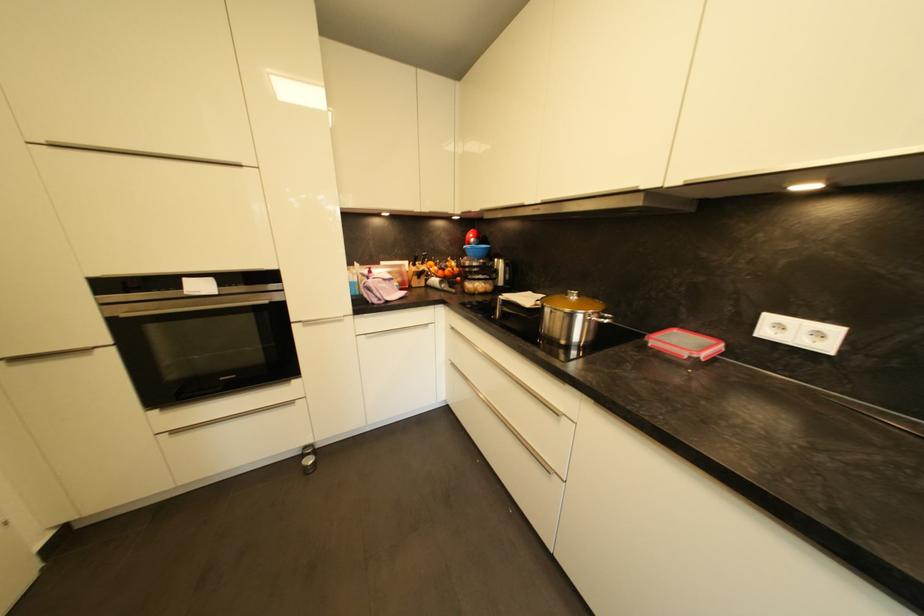
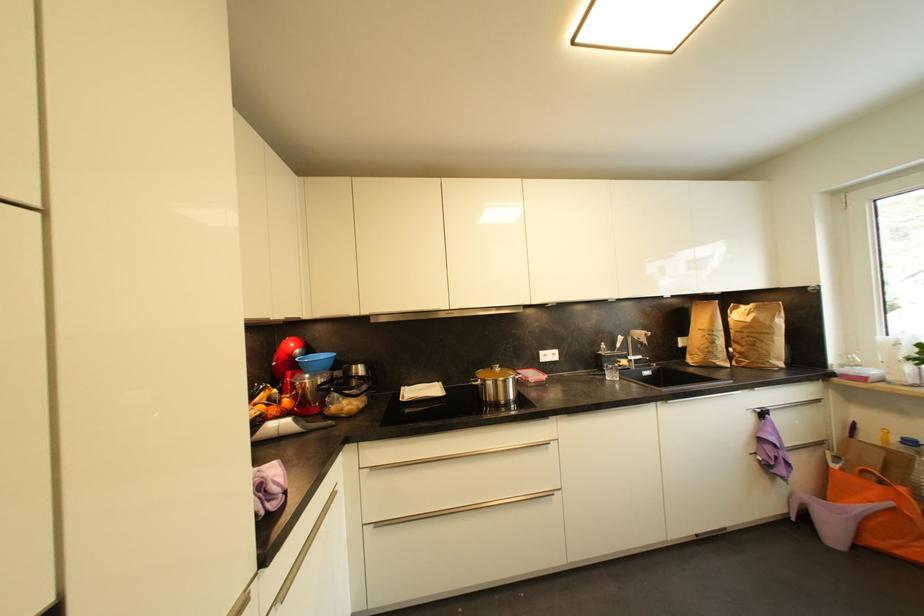
Find the pixel in the second image that matches pixel 457 366 in the first image.

(382, 527)